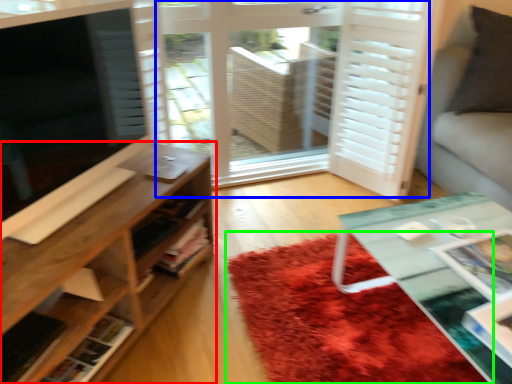
Question: Which is nearer to the shelf (highlighted by a red box)? screen door (highlighted by a blue box) or mat (highlighted by a green box).

Choices:
 (A) screen door
 (B) mat

Answer: (B)